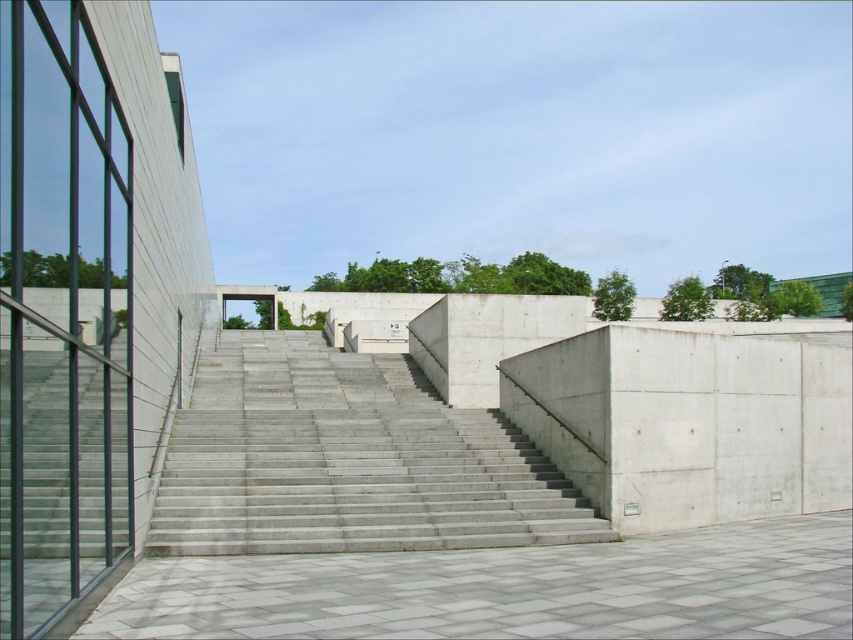
Question: Which of the following is the farthest from the observer?

Choices:
 (A) (364, 481)
 (B) (225, 580)

Answer: (A)

Question: Which of the following is the farthest from the observer?

Choices:
 (A) gray concrete stairs at center
 (B) gray concrete pavement at center

Answer: (A)

Question: Can you confirm if gray concrete stairs at center is positioned to the right of gray concrete pavement at center?

Choices:
 (A) no
 (B) yes

Answer: (A)

Question: Is gray concrete stairs at center to the right of gray concrete pavement at center from the viewer's perspective?

Choices:
 (A) no
 (B) yes

Answer: (A)

Question: Observing the image, what is the correct spatial positioning of gray concrete stairs at center in reference to gray concrete pavement at center?

Choices:
 (A) right
 (B) left

Answer: (B)

Question: Which of the following is the farthest from the observer?

Choices:
 (A) (409, 513)
 (B) (776, 528)

Answer: (B)